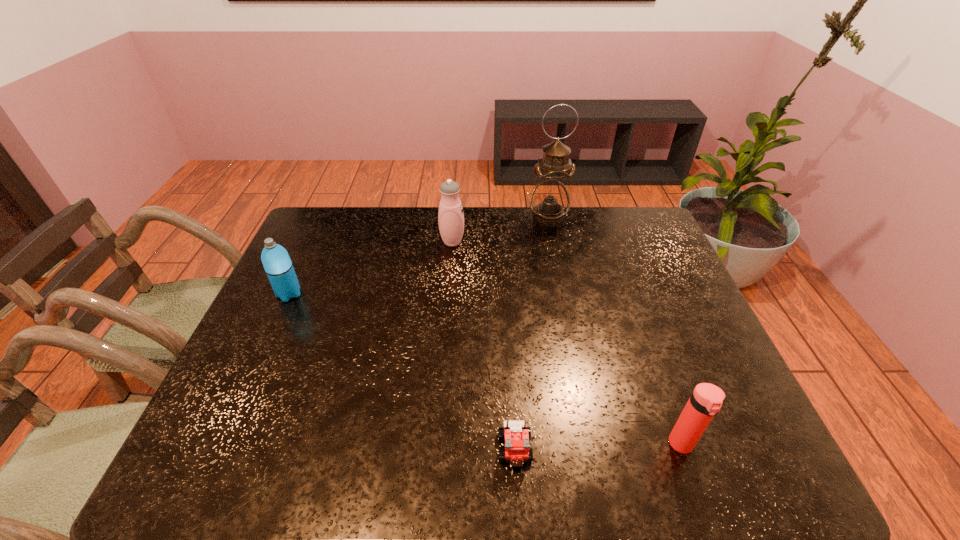
I want to click on the farthest object, so click(550, 199).

I want to click on oil lamp, so (x=550, y=199).

The width and height of the screenshot is (960, 540). Identify the location of the farthest thermos bottle. (450, 216).

This screenshot has height=540, width=960. In order to click on the fourth nearest object in this screenshot , I will do `click(450, 216)`.

Locate an element on the screen. the second nearest thermos bottle is located at coordinates (276, 261).

You are a GUI agent. You are given a task and a screenshot of the screen. Output one action in this format:
    pyautogui.click(x=<x>, y=<y>)
    Task: Click on the leftmost object
    The height and width of the screenshot is (540, 960).
    Given the screenshot: What is the action you would take?
    pos(276,261)

This screenshot has width=960, height=540. I want to click on the rightmost object, so click(x=705, y=402).

Where is `the nearest thermos bottle`? This screenshot has width=960, height=540. the nearest thermos bottle is located at coordinates (705, 402).

Where is `the third object from left to right`? Image resolution: width=960 pixels, height=540 pixels. the third object from left to right is located at coordinates (516, 436).

Locate an element on the screen. Image resolution: width=960 pixels, height=540 pixels. Lego is located at coordinates (516, 436).